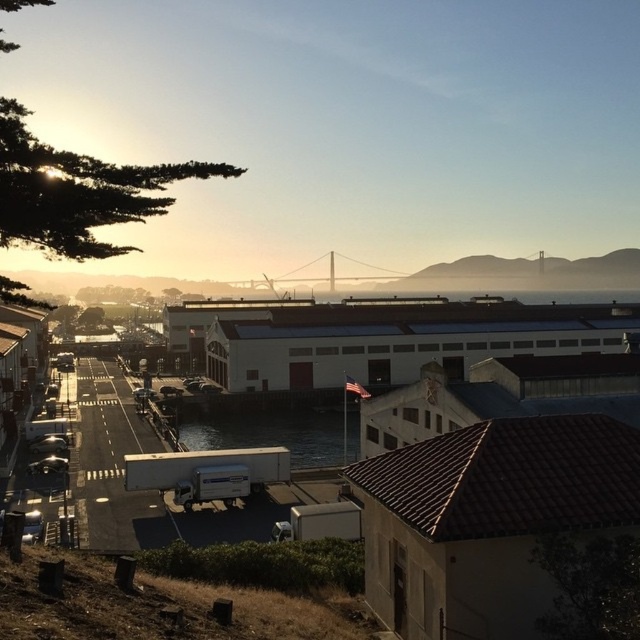
Question: Which of the following is the closest to the observer?

Choices:
 (A) metallic bridge at center
 (B) clear water at center

Answer: (B)

Question: Does clear water at center appear under metallic bridge at center?

Choices:
 (A) no
 (B) yes

Answer: (B)

Question: Is clear water at center behind metallic bridge at center?

Choices:
 (A) no
 (B) yes

Answer: (A)

Question: Can you confirm if clear water at center is bigger than metallic bridge at center?

Choices:
 (A) no
 (B) yes

Answer: (A)